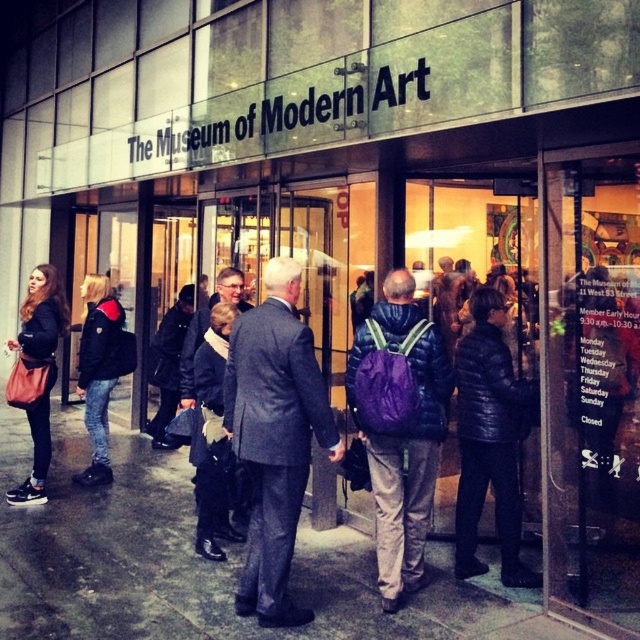
Based on the photo, can you confirm if matte black jacket at left is positioned to the right of black leather jacket at left?

In fact, matte black jacket at left is to the left of black leather jacket at left.

Is matte black jacket at left in front of black leather jacket at left?

Yes, matte black jacket at left is closer to the viewer.

Does point (29, 305) lie behind point (100, 376)?

No, (29, 305) is closer to viewer.

You are a GUI agent. You are given a task and a screenshot of the screen. Output one action in this format:
    pyautogui.click(x=<x>, y=<y>)
    Task: Click on the matte black jacket at left
    The width and height of the screenshot is (640, 640).
    Given the screenshot: What is the action you would take?
    pyautogui.click(x=36, y=372)

In the scene shown: Which is more to the right, purple matte backpack at center or matte black jacket at left?

purple matte backpack at center

This screenshot has width=640, height=640. Describe the element at coordinates (400, 428) in the screenshot. I see `purple matte backpack at center` at that location.

Identify the location of purple matte backpack at center. (400, 428).

Does point (237, 416) lie behind point (513, 536)?

No, it is not.

Where is `gray wool suit at center`? gray wool suit at center is located at coordinates (275, 436).